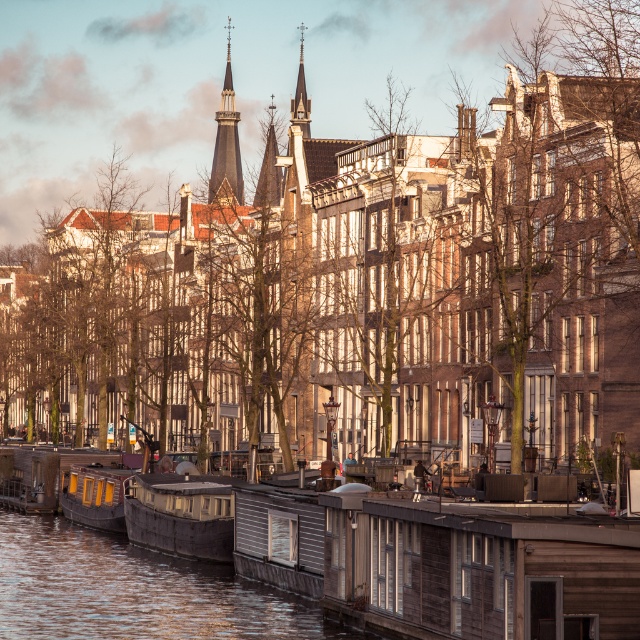
Question: Is wooden cabin boat at lower left in front of dark brown wooden spire at upper center?

Choices:
 (A) yes
 (B) no

Answer: (A)

Question: Among these objects, which one is nearest to the camera?

Choices:
 (A) wooden cabin boat at lower left
 (B) dark brown wooden spire at upper center
 (C) wooden boat at center

Answer: (C)

Question: Is smooth gray spire at center bigger than smooth stone spire at center?

Choices:
 (A) no
 (B) yes

Answer: (B)

Question: Does wooden cabin boat at lower left appear under smooth stone spire at center?

Choices:
 (A) no
 (B) yes

Answer: (B)

Question: Which point is farther from the camera taking this photo?

Choices:
 (A) (300, 48)
 (B) (204, 538)
 (C) (216, 170)

Answer: (C)

Question: Which object is farther from the camera taking this photo?

Choices:
 (A) smooth stone spire at center
 (B) wooden cabin boat at lower left

Answer: (A)